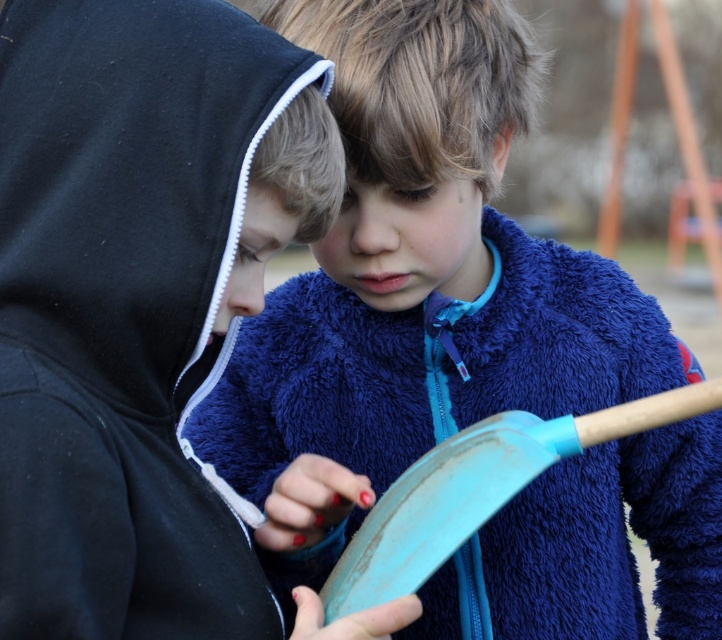
You are a photographer who wants to capture a closeup of the blue fuzzy sweater at center. Based on the scene description, where should you position your camera to ensure the sweater is in the center of the photo?

The blue fuzzy sweater at center is located at point 0.444 on the x axis and 0.578 on the y axis, so position the camera so that the center of the photo aligns with these coordinates to capture the sweater in the center.

You are a photographer trying to capture a closeup of the teal plastic shovel at center. Since the blue fuzzy sweater at center is in the way, can you determine if you can move the shovel to the side without moving the sweater? Explain your reasoning based on their sizes.

The blue fuzzy sweater at center is taller than the teal plastic shovel at center. Since the sweater is taller, it might block the shovel from being moved sideways unless there is enough space around it. However, the exact positioning isn t specified, so it depends on the available space between them.